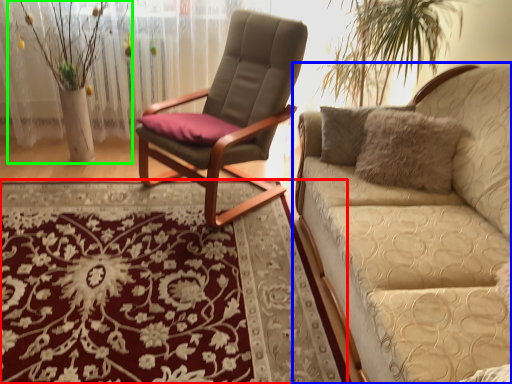
Question: Which object is positioned closest to mat (highlighted by a red box)? Select from studio couch (highlighted by a blue box) and floral arrangement (highlighted by a green box).

Choices:
 (A) studio couch
 (B) floral arrangement

Answer: (A)